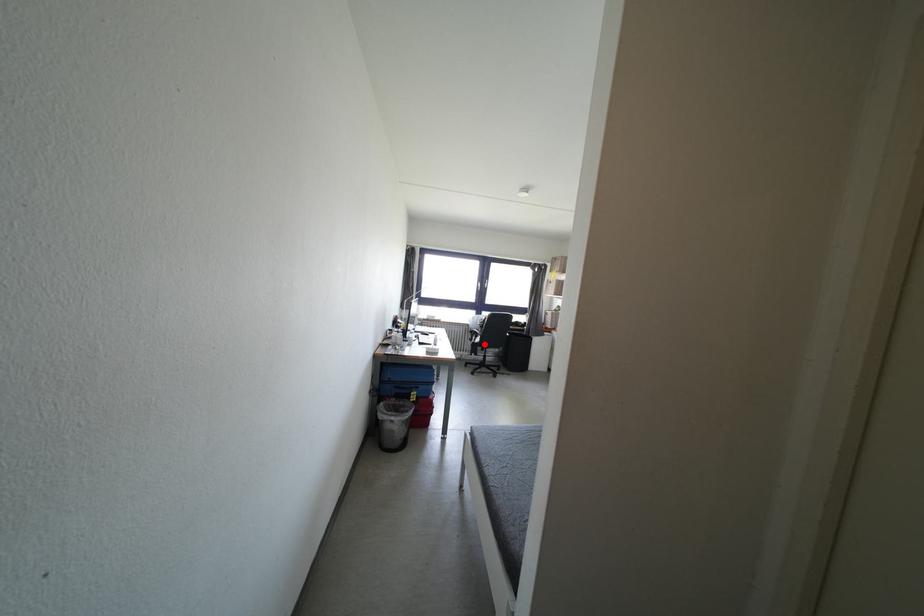
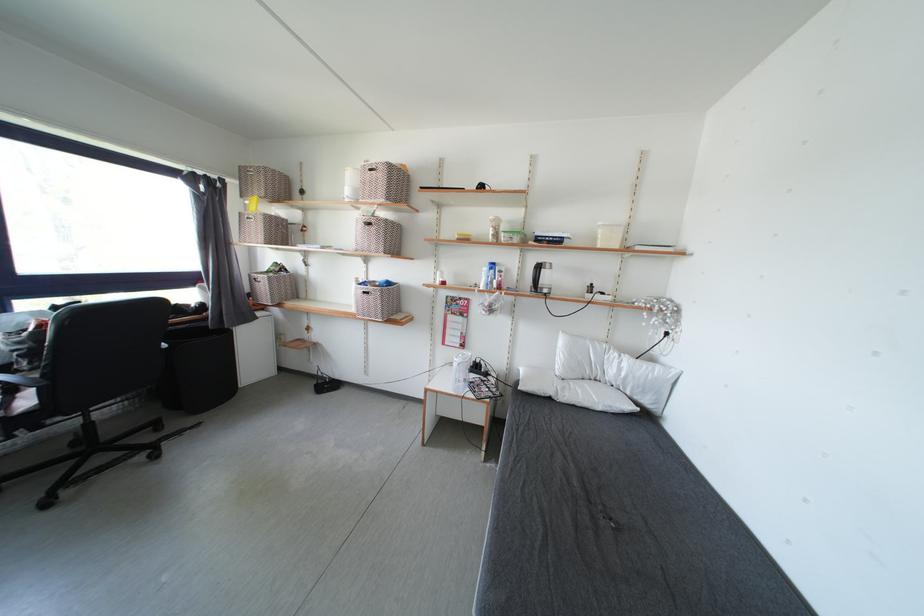
Question: I am providing you with two images of the same scene from different viewpoints. A red point is shown in image1. For the corresponding object point in image2, is it positioned nearer or farther from the camera?

Choices:
 (A) Nearer
 (B) Farther

Answer: (A)